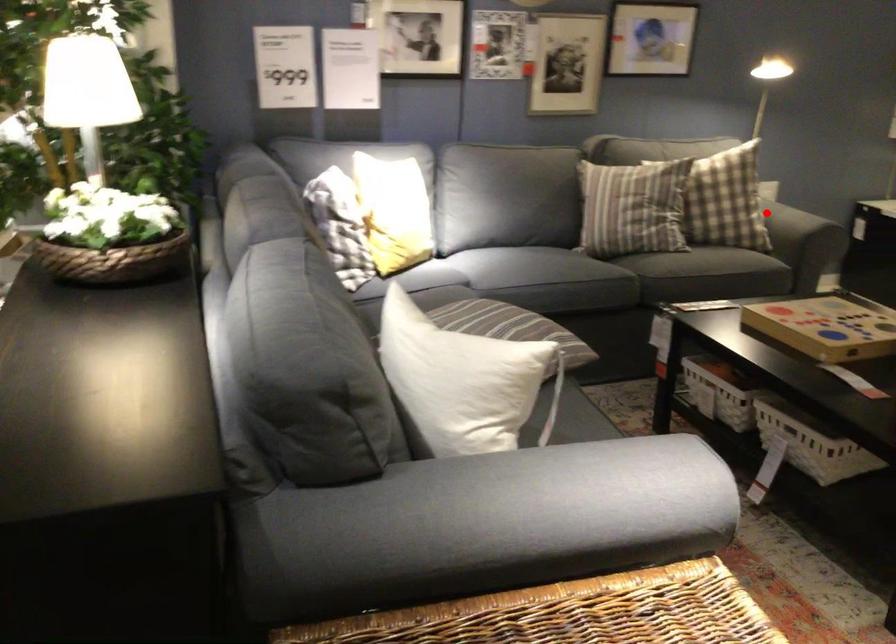
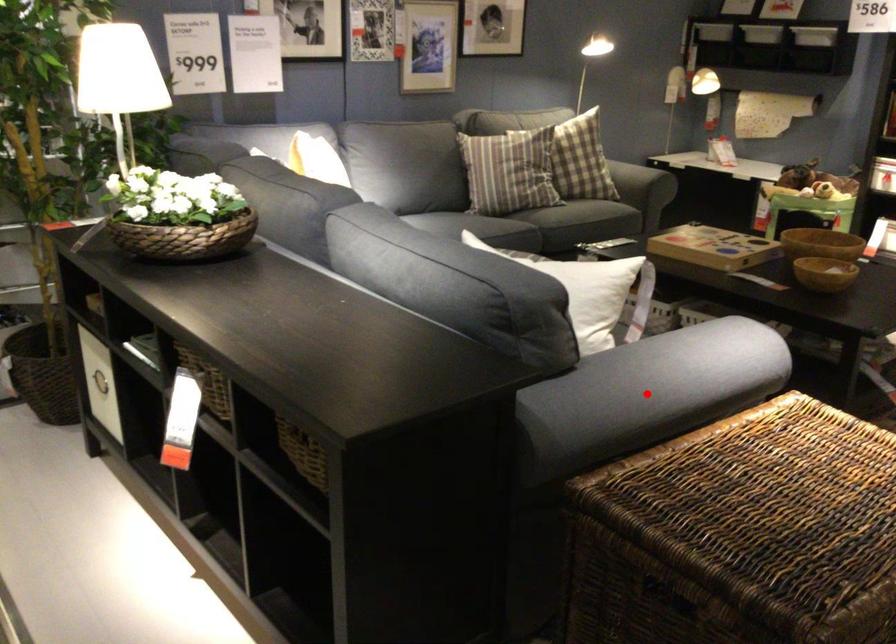
I am providing you with two images of the same scene from different viewpoints. A red point is marked on the first image and another point is marked on the second image. Do the highlighted points in image1 and image2 indicate the same real-world spot?

No